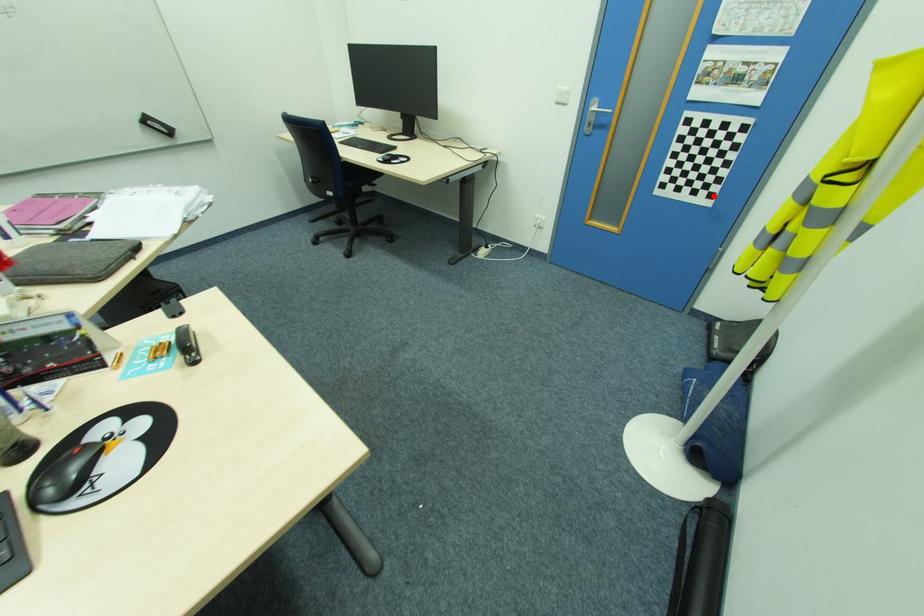
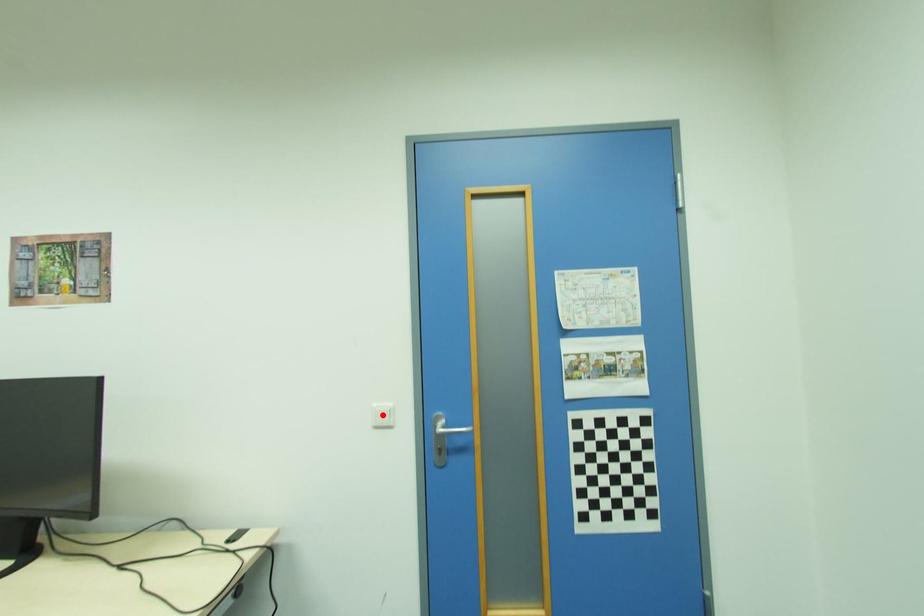
I am providing you with two images of the same scene from different viewpoints. A red point is marked on the first image and another point is marked on the second image. Do the highlighted points in image1 and image2 indicate the same real-world spot?

No